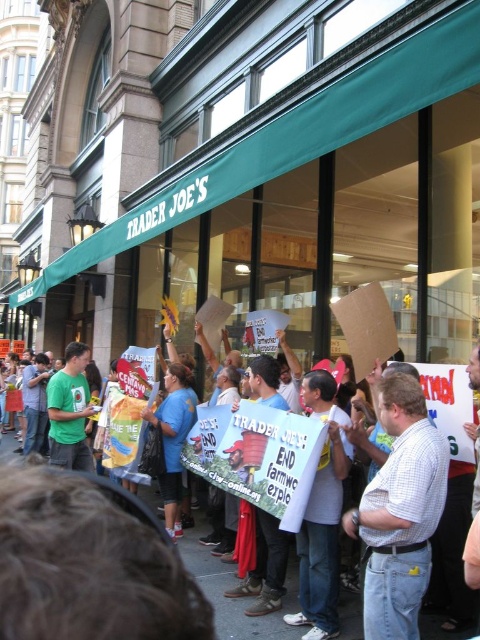
Is point (365, 605) positioned in front of point (247, 625)?

Yes, it is.

Is white checkered shirt at center wider than blue t-shirt at center?

No.

Who is more forward, (x=409, y=556) or (x=196, y=552)?

Point (x=409, y=556)

You are a GUI agent. You are given a task and a screenshot of the screen. Output one action in this format:
    pyautogui.click(x=<x>, y=<y>)
    Task: Click on the white checkered shirt at center
    
    Given the screenshot: What is the action you would take?
    pyautogui.click(x=400, y=513)